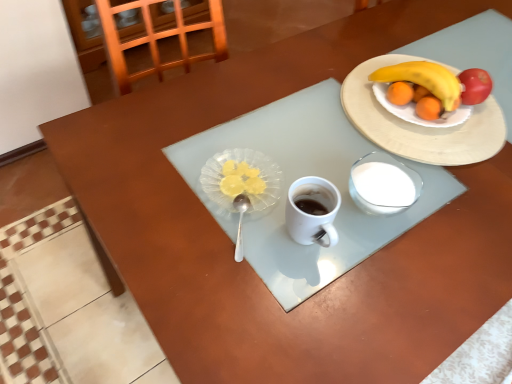
This screenshot has width=512, height=384. In order to click on free point below white ceramic plate at upper right (from a real-world perspective) in this screenshot , I will do `click(430, 121)`.